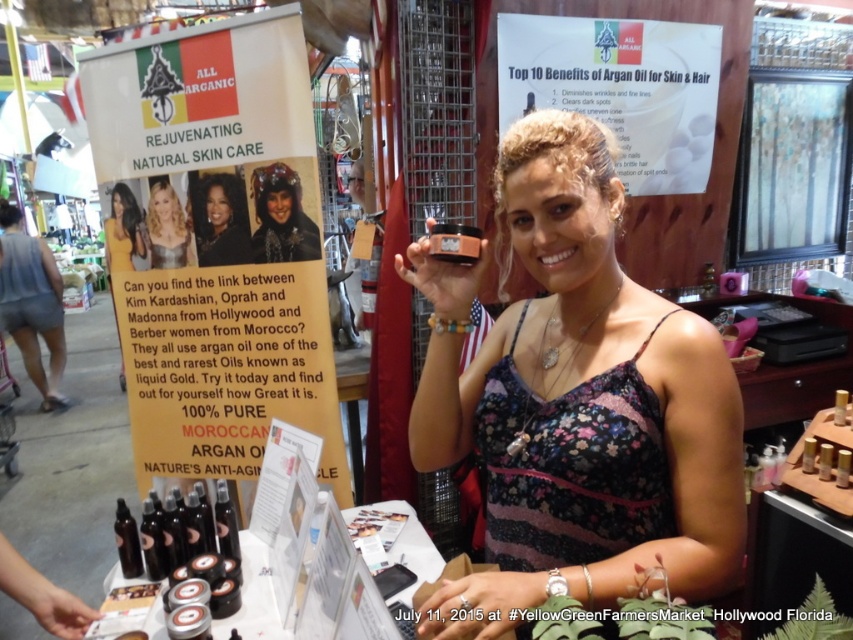
Based on the photo, is matte brown jar at center shorter than yellow fabric kimono at upper left?

No.

Which is behind, point (720, 506) or point (142, 259)?

Positioned behind is point (142, 259).

At what (x,y) coordinates should I click in order to perform the action: click on matte brown jar at center. Please return your answer as a coordinate pair (x, y). This screenshot has width=853, height=640. Looking at the image, I should click on (576, 401).

Who is lower down, matte brown jar at center or matte black hair at center?

matte brown jar at center

Between point (688, 467) and point (225, 216), which one is positioned behind?

The point (225, 216) is more distant.

You are a GUI agent. You are given a task and a screenshot of the screen. Output one action in this format:
    pyautogui.click(x=<x>, y=<y>)
    Task: Click on the matte brown jar at center
    This screenshot has width=853, height=640.
    Given the screenshot: What is the action you would take?
    pyautogui.click(x=576, y=401)

What do you see at coordinates (281, 218) in the screenshot? This screenshot has width=853, height=640. I see `matte black helmet at center` at bounding box center [281, 218].

Measure the distance between matte black helmet at center and yellow fabric kimono at upper left.

matte black helmet at center and yellow fabric kimono at upper left are 18.63 inches apart.

Which is in front, point (316, 241) or point (113, 216)?

Point (316, 241)

Locate an element on the screen. The width and height of the screenshot is (853, 640). matte black helmet at center is located at coordinates (281, 218).